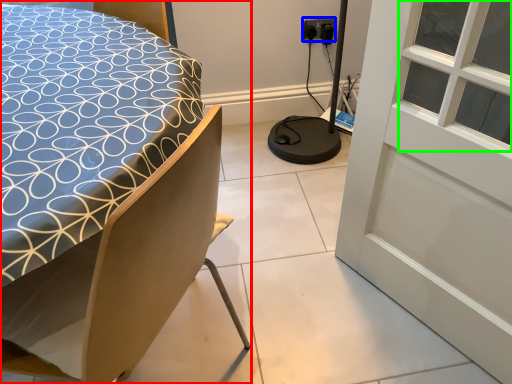
Question: Considering the real-world distances, which object is closest to bed (highlighted by a red box)? electric outlet (highlighted by a blue box) or window (highlighted by a green box).

Choices:
 (A) electric outlet
 (B) window

Answer: (B)